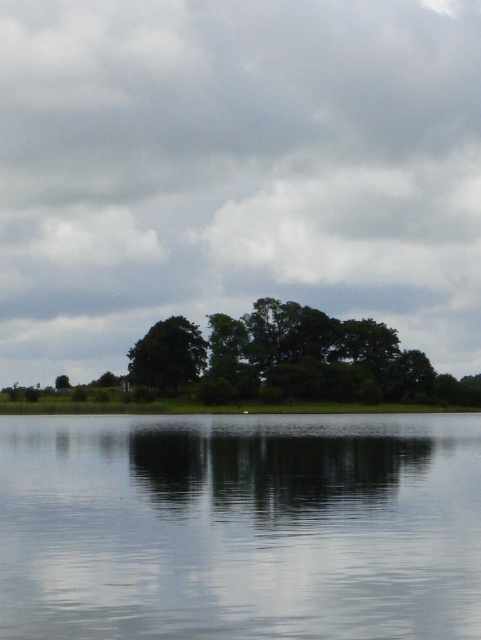
You are standing at the edge of the water in the scene and see two points labeled as point (33, 588) and point (159, 358). Which point is closer to you?

Point (33, 588) is closer to you because it is in front of point (159, 358).

You are standing at the edge of the water and want to place a small floating decoration exactly at the center of the transparent water at center. According to the coordinates provided, where should you position it?

The transparent water at center should be positioned at coordinates point (240, 525).

You are standing at the edge of the water and want to determine which object is taller between the transparent water at center and the green leafy tree at center. Based on the scene, which one is taller?

The green leafy tree at center is taller than the transparent water at center.